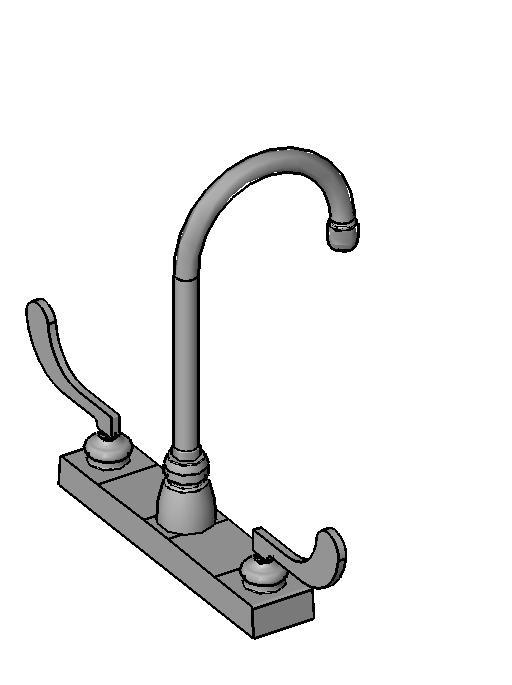
You are a GUI agent. You are given a task and a screenshot of the screen. Output one action in this format:
    pyautogui.click(x=<x>, y=<y>)
    Task: Click on the 1 base for the knobs and faucet
    Image resolution: width=512 pixels, height=685 pixels.
    Given the screenshot: What is the action you would take?
    pyautogui.click(x=256, y=614)